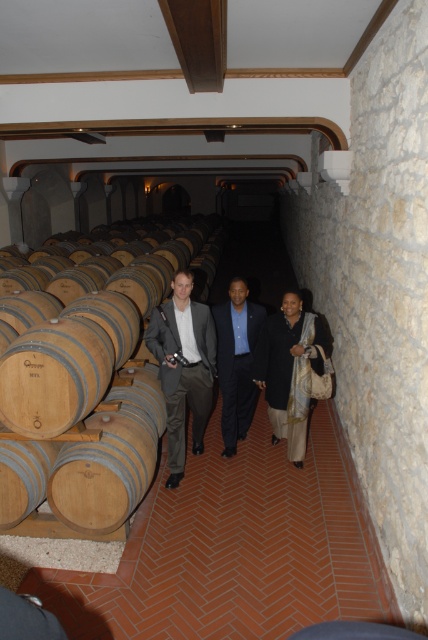
Question: Which object appears farthest from the camera in this image?

Choices:
 (A) dark blue suit at center
 (B) dark blue fabric dress at center
 (C) wooden barrel at left

Answer: (A)

Question: Which point is closer to the camera?

Choices:
 (A) (190, 307)
 (B) (193, 257)
 (C) (296, 451)
 (D) (255, 321)

Answer: (A)

Question: Is wooden barrel at left positioned at the back of dark blue fabric dress at center?

Choices:
 (A) no
 (B) yes

Answer: (A)

Question: Considering the real-world distances, which object is closest to the wooden barrel at left?

Choices:
 (A) dark blue suit at center
 (B) dark blue fabric dress at center
 (C) matte gray suit at center

Answer: (C)

Question: Can you confirm if wooden barrel at left is positioned to the right of dark blue suit at center?

Choices:
 (A) yes
 (B) no

Answer: (B)

Question: Does wooden barrel at left have a smaller size compared to matte gray suit at center?

Choices:
 (A) yes
 (B) no

Answer: (B)